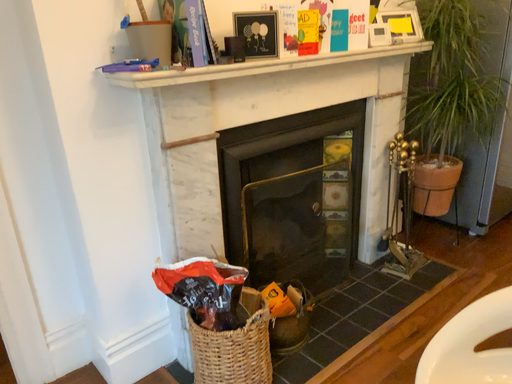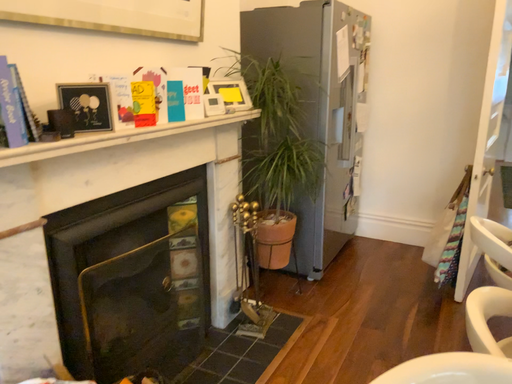
Question: Which way did the camera rotate in the video?

Choices:
 (A) rotated right
 (B) rotated left

Answer: (A)